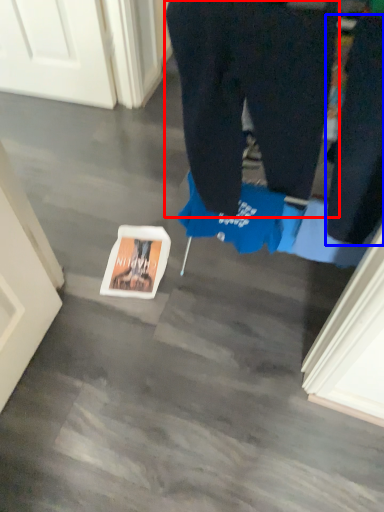
Question: Among these objects, which one is farthest to the camera, trousers (highlighted by a red box) or pants (highlighted by a blue box)?

Choices:
 (A) trousers
 (B) pants

Answer: (A)